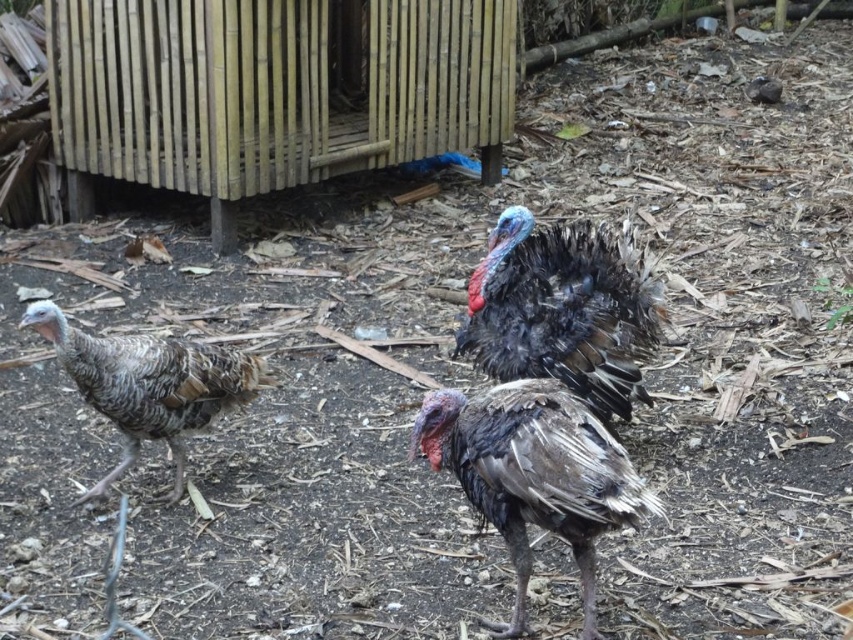
Question: From the image, what is the correct spatial relationship of dark feathered turkey at center in relation to gray speckled turkey at left?

Choices:
 (A) below
 (B) above

Answer: (B)

Question: Which object is the closest to the dark feathered turkey at center?

Choices:
 (A) gray speckled turkey at left
 (B) gray matte turkey at center

Answer: (B)

Question: Is dark feathered turkey at center to the left of gray speckled turkey at left from the viewer's perspective?

Choices:
 (A) yes
 (B) no

Answer: (B)

Question: Which point is farther from the camera taking this photo?

Choices:
 (A) (418, 435)
 (B) (489, 364)

Answer: (B)

Question: In this image, where is dark feathered turkey at center located relative to gray matte turkey at center?

Choices:
 (A) below
 (B) above

Answer: (B)

Question: Which object is the farthest from the dark feathered turkey at center?

Choices:
 (A) gray speckled turkey at left
 (B) gray matte turkey at center

Answer: (A)